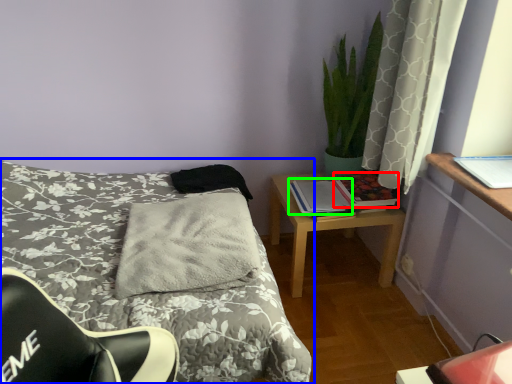
Question: Considering the real-world distances, which object is closest to book (highlighted by a red box)? bed (highlighted by a blue box) or book (highlighted by a green box).

Choices:
 (A) bed
 (B) book

Answer: (B)